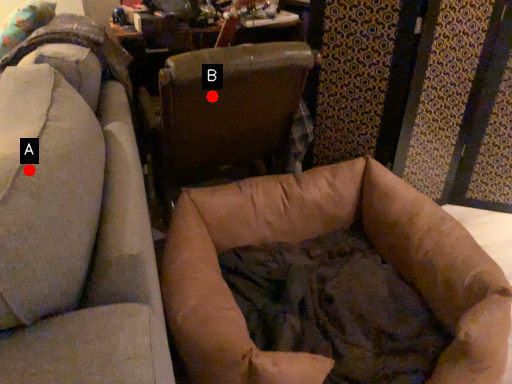
Question: Two points are circled on the image, labeled by A and B beside each circle. Which point is closer to the camera?

Choices:
 (A) A is closer
 (B) B is closer

Answer: (A)